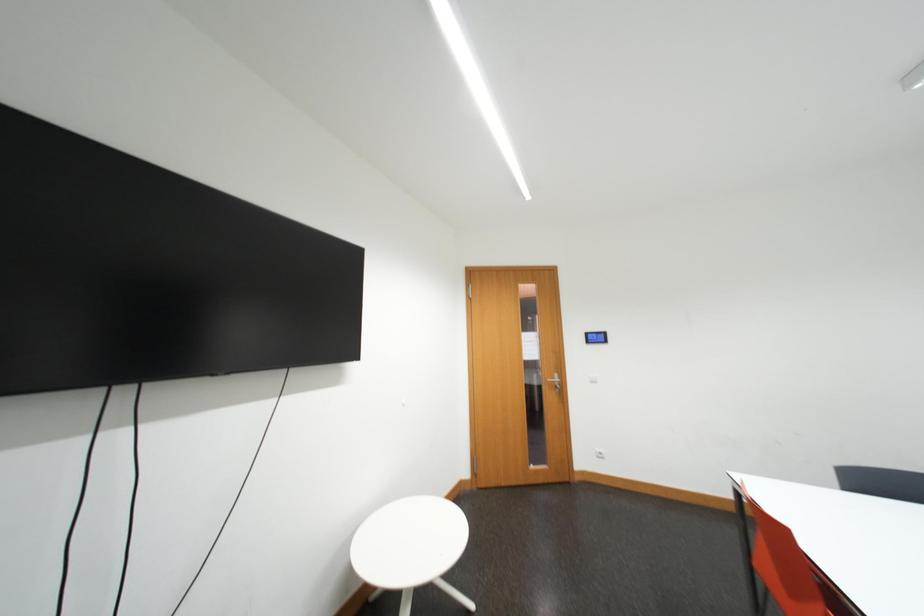
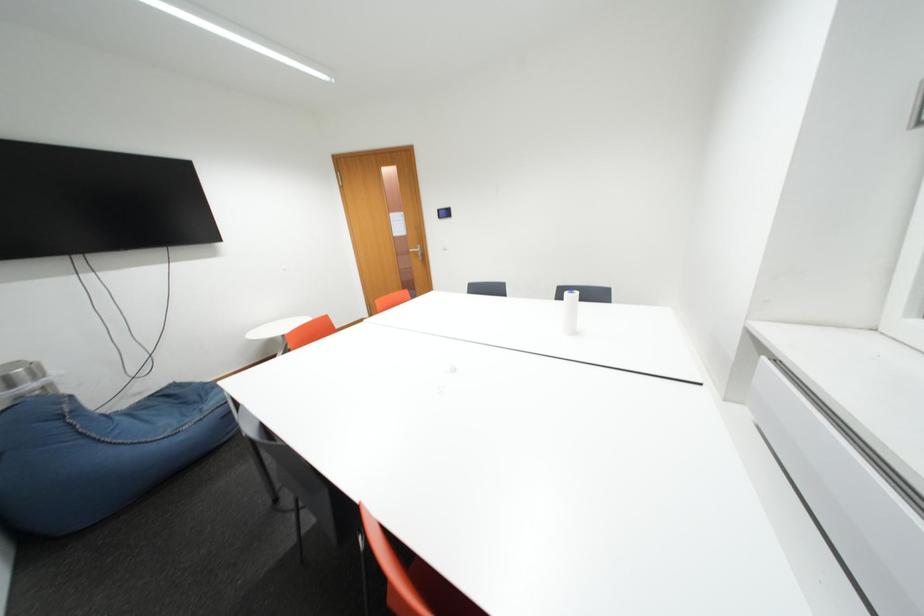
What movement of the cameraman would produce the second image?

The cameraman moved toward right, backward.